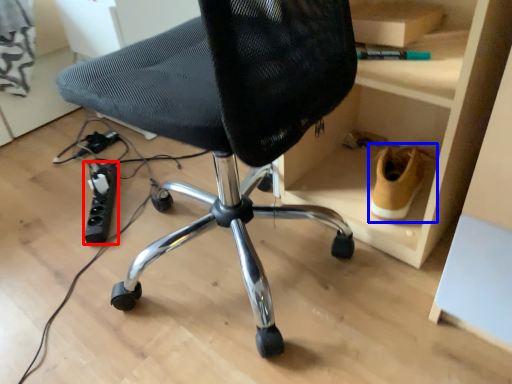
Question: Which object appears closest to the camera in this image, plug (highlighted by a red box) or footwear (highlighted by a blue box)?

Choices:
 (A) plug
 (B) footwear

Answer: (B)